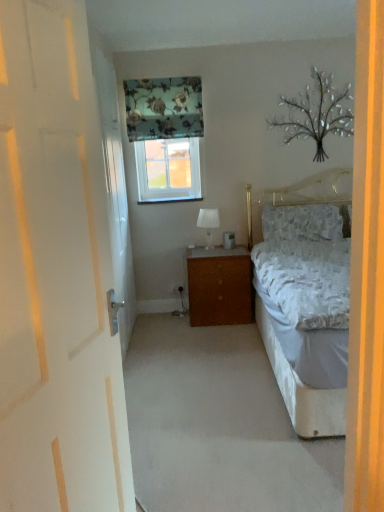
Image resolution: width=384 pixels, height=512 pixels. Identify the location of free point below white fabric lampshade at center (from a real-world perspective). (200, 244).